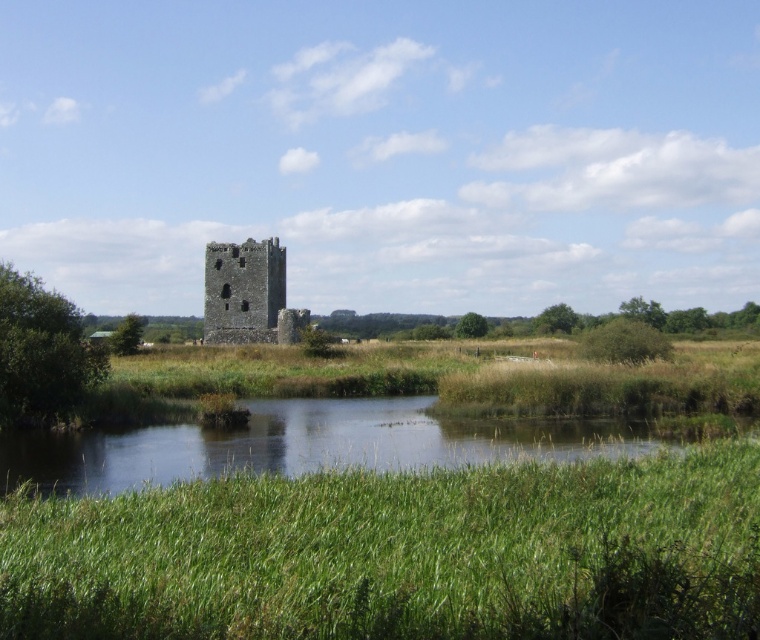
Question: Does green grassy river at lower center appear on the left side of rustic stone tower at center?

Choices:
 (A) no
 (B) yes

Answer: (A)

Question: Which of the following is the closest to the observer?

Choices:
 (A) (255, 332)
 (B) (52, 460)

Answer: (B)

Question: Is the position of green grassy river at lower center more distant than that of rustic stone tower at center?

Choices:
 (A) yes
 (B) no

Answer: (B)

Question: Does green grassy river at lower center appear under rustic stone tower at center?

Choices:
 (A) no
 (B) yes

Answer: (B)

Question: Which point is closer to the camera?

Choices:
 (A) (222, 269)
 (B) (513, 419)

Answer: (B)